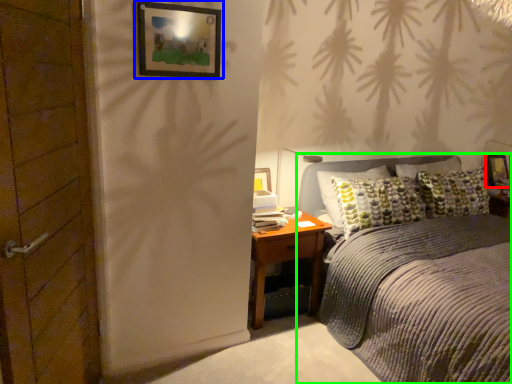
Question: Estimate the real-world distances between objects in this image. Which object is closer to picture frame (highlighted by a red box), picture frame (highlighted by a blue box) or bed (highlighted by a green box)?

Choices:
 (A) picture frame
 (B) bed

Answer: (B)